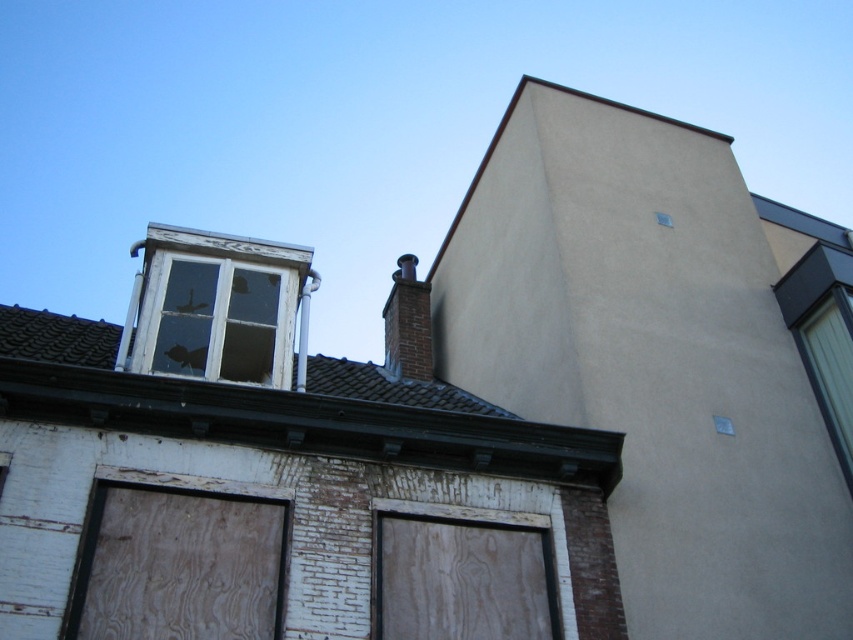
Question: Which of the following is the farthest from the observer?

Choices:
 (A) plywood door at lower center
 (B) clear glass window at upper right
 (C) white wooden window at upper left

Answer: (B)

Question: Is wooden board at lower left above clear glass window at upper right?

Choices:
 (A) yes
 (B) no

Answer: (B)

Question: Is smooth gray slate roof at upper center in front of wooden board at lower left?

Choices:
 (A) yes
 (B) no

Answer: (B)

Question: Which of the following is the closest to the observer?

Choices:
 (A) wooden board at lower left
 (B) brick chimney at upper center

Answer: (A)

Question: Which of the following is the farthest from the observer?

Choices:
 (A) (77, 317)
 (B) (824, 344)
 (C) (540, 586)

Answer: (A)

Question: Can you confirm if white wooden window at upper left is positioned above plywood door at lower center?

Choices:
 (A) no
 (B) yes

Answer: (B)